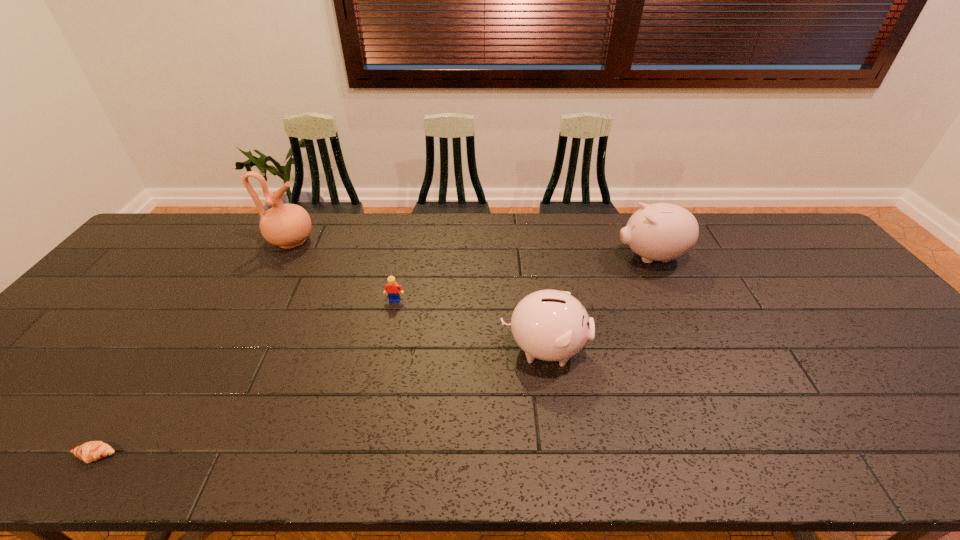
Find the location of a particular element. This screenshot has height=540, width=960. free spot between the tallest object and the second object from right to left is located at coordinates (418, 295).

Find the location of a particular element. vacant space in between the right piggy bank and the leftmost object is located at coordinates (373, 356).

The height and width of the screenshot is (540, 960). Identify the location of vacant space that's between the pottery and the rightmost object. (471, 249).

Choose which object is the fourth nearest neighbor to the nearer piggy bank. Please provide its 2D coordinates. Your answer should be formatted as a tuple, i.e. [(x, y)], where the tuple contains the x and y coordinates of a point satisfying the conditions above.

[(88, 452)]

Locate an element on the screen. object that can be found as the second closest to the tallest object is located at coordinates (88, 452).

Image resolution: width=960 pixels, height=540 pixels. Find the location of `vacant space that satisfies the following two spatial constraints: 1. on the spout of the second object from left to right; 2. on the front-facing side of the leftmost object`. vacant space that satisfies the following two spatial constraints: 1. on the spout of the second object from left to right; 2. on the front-facing side of the leftmost object is located at coordinates (176, 455).

This screenshot has height=540, width=960. Identify the location of free spot that satisfies the following two spatial constraints: 1. at the snout of the right piggy bank; 2. on the face of the second shortest object. [x=671, y=300].

I want to click on vacant space that satisfies the following two spatial constraints: 1. on the spout of the tallest object; 2. on the right side of the fourth object from left to right, so click(233, 349).

Image resolution: width=960 pixels, height=540 pixels. In order to click on blank area in the image that satisfies the following two spatial constraints: 1. on the face of the fourth farthest object; 2. on the right side of the second shortest object in this screenshot , I will do `click(385, 349)`.

This screenshot has width=960, height=540. In order to click on vacant area that satisfies the following two spatial constraints: 1. at the snout of the farther piggy bank; 2. on the front-facing side of the leftmost object in this screenshot , I will do `click(743, 455)`.